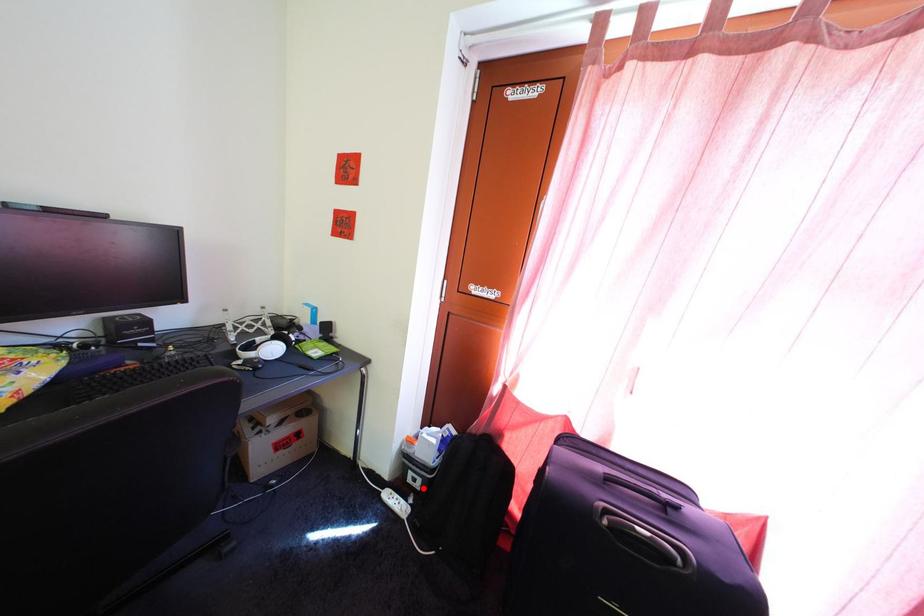
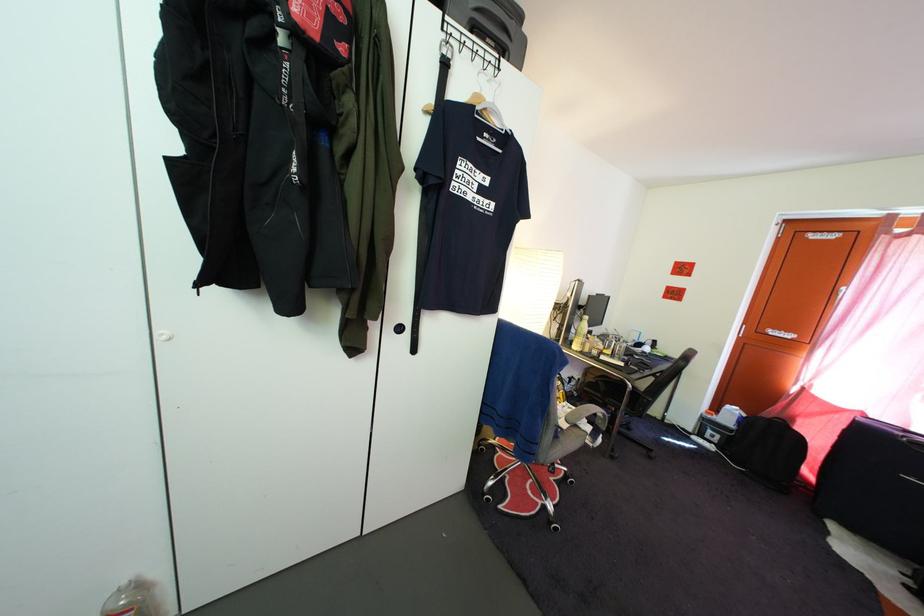
Find the pixel in the second image that matches the highlighted location in the first image.

(721, 445)